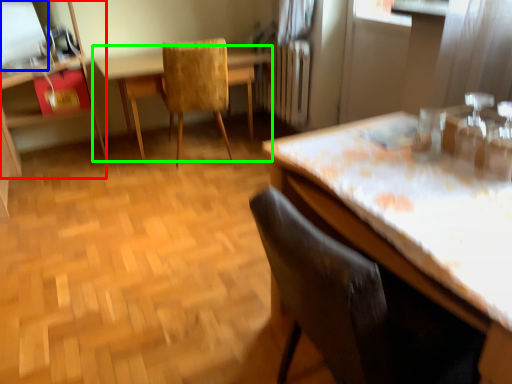
Question: Considering the real-world distances, which object is closest to dresser (highlighted by a red box)? window screen (highlighted by a blue box) or table (highlighted by a green box).

Choices:
 (A) window screen
 (B) table

Answer: (A)